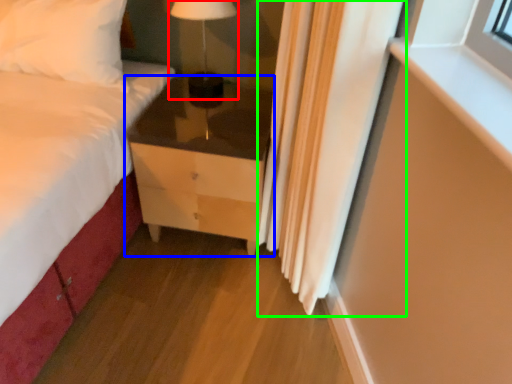
Question: Which object is positioned farthest from table lamp (highlighted by a red box)? Select from chest of drawers (highlighted by a blue box) and curtain (highlighted by a green box).

Choices:
 (A) chest of drawers
 (B) curtain

Answer: (B)